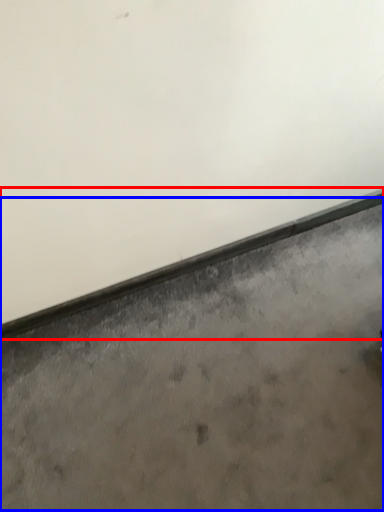
Question: Which object is closer to the camera taking this photo, window sill (highlighted by a red box) or concrete (highlighted by a blue box)?

Choices:
 (A) window sill
 (B) concrete

Answer: (B)